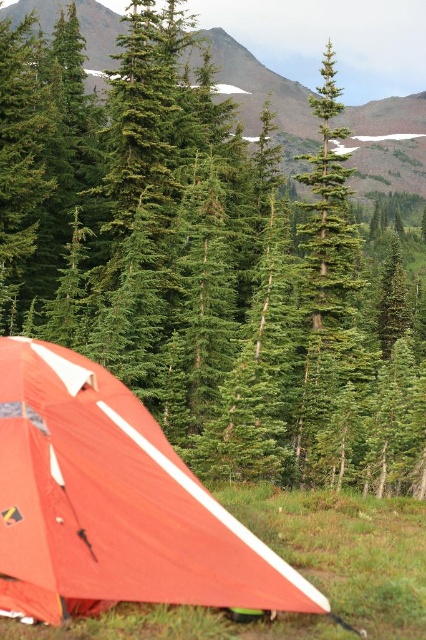
Does green textured mountain at upper center come behind green textured pine tree at center?

Yes, it is.

Is point (250, 81) positioned after point (302, 275)?

Yes, point (250, 81) is farther from viewer.

Is point (104, 44) positioned after point (302, 468)?

Yes.

Locate an element on the screen. The width and height of the screenshot is (426, 640). green textured mountain at upper center is located at coordinates (388, 145).

Describe the element at coordinates (112, 502) in the screenshot. I see `orange fabric tent at lower left` at that location.

Can you confirm if orange fabric tent at lower left is positioned below green textured pine tree at center?

Indeed, orange fabric tent at lower left is positioned under green textured pine tree at center.

Who is more distant from viewer, (72, 442) or (313, 186)?

The point (313, 186) is more distant.

Where is `orange fabric tent at lower left`? This screenshot has width=426, height=640. orange fabric tent at lower left is located at coordinates (112, 502).

Can you confirm if orange fabric tent at lower left is positioned above green textured mountain at upper center?

No.

Locate an element on the screen. Image resolution: width=426 pixels, height=640 pixels. orange fabric tent at lower left is located at coordinates (112, 502).

Find the location of a particular element. This screenshot has width=426, height=640. orange fabric tent at lower left is located at coordinates (112, 502).